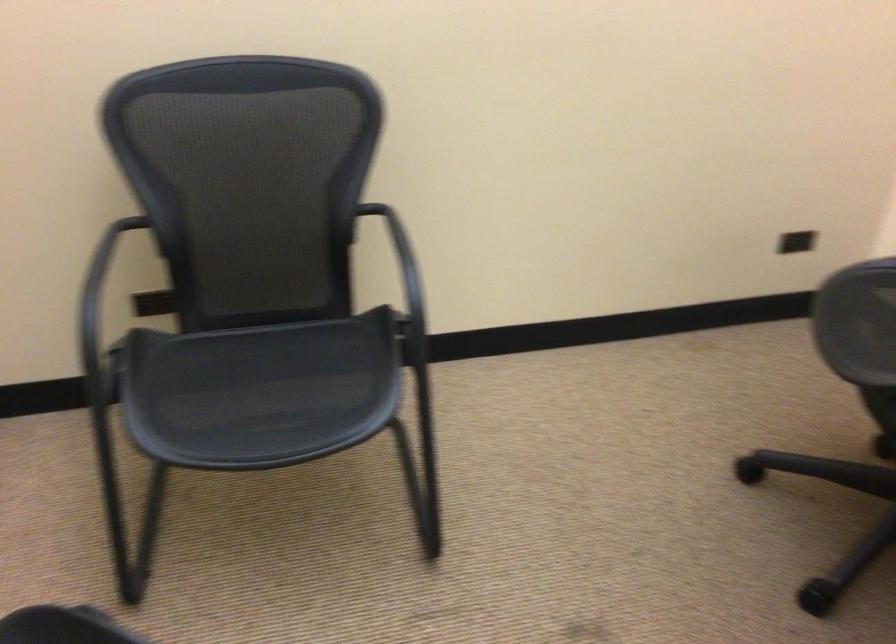
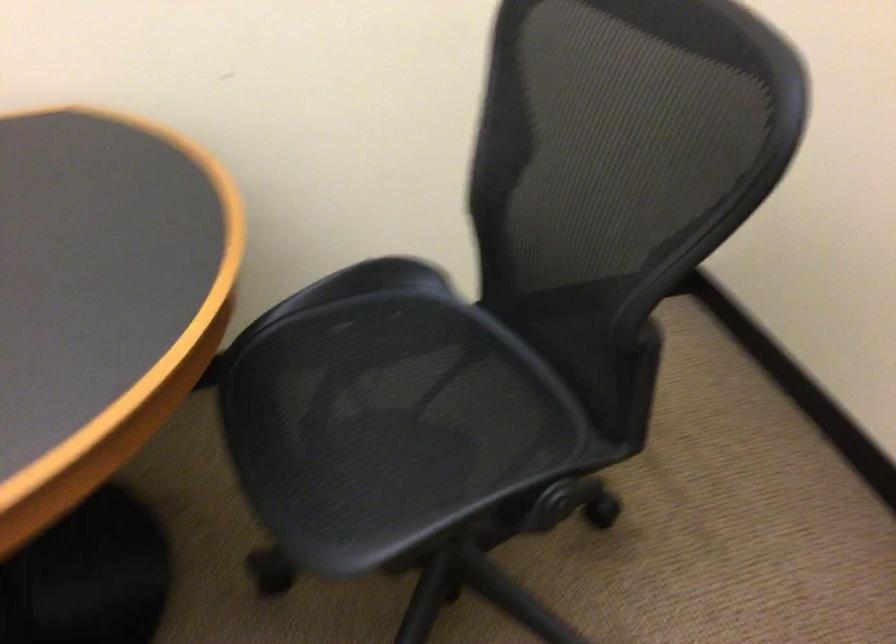
The images are taken continuously from a first-person perspective. In which direction is your viewpoint rotating?

The camera's rotation is toward right-down.